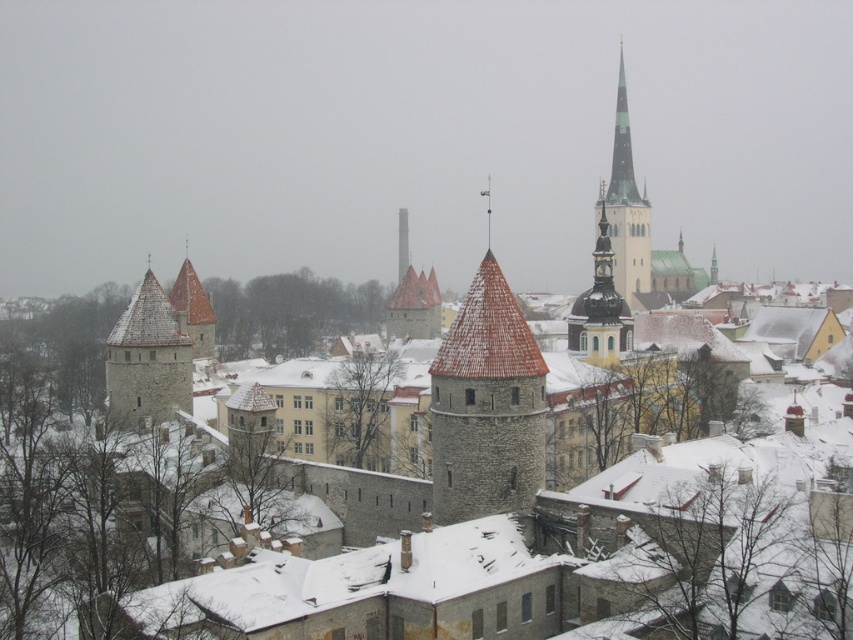
Question: Does smooth gold clock tower at center have a larger size compared to brown stone tower at center?

Choices:
 (A) yes
 (B) no

Answer: (B)

Question: Considering the real-world distances, which object is closest to the smooth gold clock tower at center?

Choices:
 (A) gray stone tower at center-left
 (B) smooth gray stone tower at center
 (C) smooth gray spire at upper right
 (D) brown stone tower at center

Answer: (C)

Question: Estimate the real-world distances between objects in this image. Which object is closer to the smooth gold clock tower at center?

Choices:
 (A) smooth gray stone tower at center
 (B) brown stone tower at center
 (C) gray stone tower at center-left

Answer: (C)

Question: Is smooth stone tower at center to the right of brown stone tower at center from the viewer's perspective?

Choices:
 (A) yes
 (B) no

Answer: (A)

Question: Is smooth gray spire at upper right wider than brown stone tower at center?

Choices:
 (A) yes
 (B) no

Answer: (B)

Question: Which of the following is the farthest from the observer?

Choices:
 (A) smooth gold clock tower at center
 (B) smooth gray spire at upper right
 (C) brown stone tower at center
 (D) gray stone tower at center-left

Answer: (B)